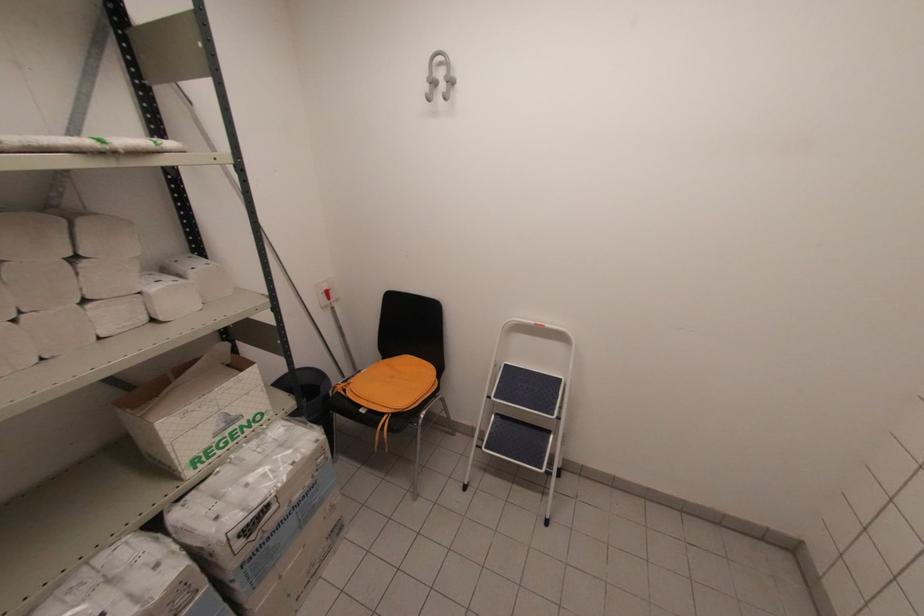
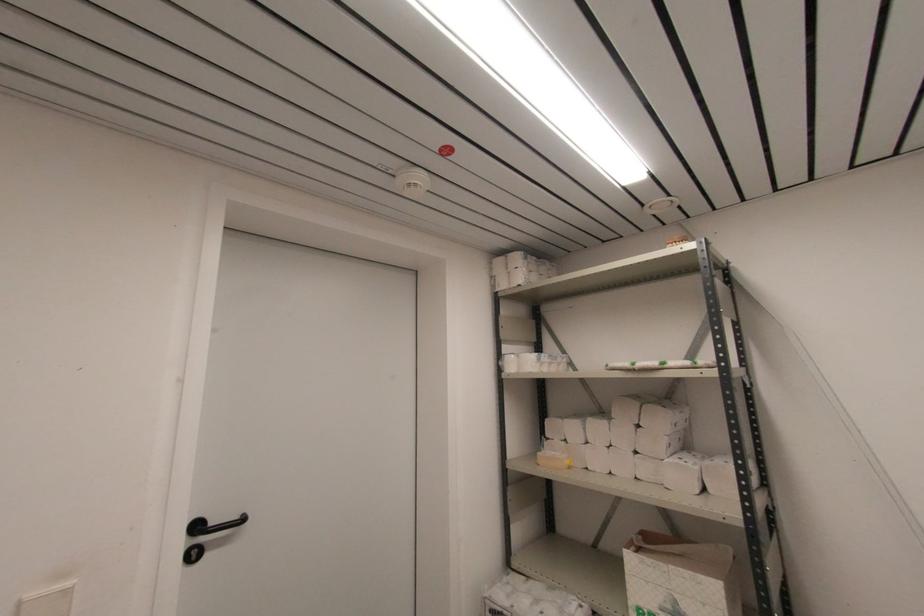
Where in the second image is the point corresponding to (84,302) from the first image?

(637, 453)